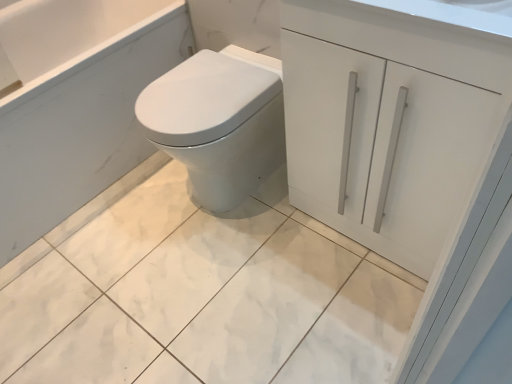
Question: Should I look upward or downward to see white glossy cabinet at upper right?

Choices:
 (A) up
 (B) down

Answer: (A)

Question: Is white glossy bidet at center bigger than white glossy cabinet at upper right?

Choices:
 (A) yes
 (B) no

Answer: (A)

Question: Does white glossy bidet at center lie in front of white glossy cabinet at upper right?

Choices:
 (A) no
 (B) yes

Answer: (A)

Question: Can you confirm if white glossy bidet at center is wider than white glossy cabinet at upper right?

Choices:
 (A) yes
 (B) no

Answer: (A)

Question: Is white glossy bidet at center at the left side of white glossy cabinet at upper right?

Choices:
 (A) yes
 (B) no

Answer: (A)

Question: Considering the relative positions of white glossy bidet at center and white glossy cabinet at upper right in the image provided, is white glossy bidet at center to the right of white glossy cabinet at upper right from the viewer's perspective?

Choices:
 (A) no
 (B) yes

Answer: (A)

Question: From the image's perspective, is white glossy bidet at center on top of white glossy cabinet at upper right?

Choices:
 (A) yes
 (B) no

Answer: (B)

Question: Considering the relative positions of white marble tile at center and white glossy cabinet at upper right in the image provided, is white marble tile at center in front of white glossy cabinet at upper right?

Choices:
 (A) no
 (B) yes

Answer: (A)

Question: Is white marble tile at center not within white glossy cabinet at upper right?

Choices:
 (A) yes
 (B) no

Answer: (A)

Question: Is white marble tile at center to the right of white glossy cabinet at upper right from the viewer's perspective?

Choices:
 (A) no
 (B) yes

Answer: (A)

Question: Can you confirm if white marble tile at center is thinner than white glossy cabinet at upper right?

Choices:
 (A) yes
 (B) no

Answer: (B)

Question: Is white marble tile at center positioned behind white glossy cabinet at upper right?

Choices:
 (A) no
 (B) yes

Answer: (B)

Question: Does white marble tile at center have a smaller size compared to white glossy cabinet at upper right?

Choices:
 (A) yes
 (B) no

Answer: (B)

Question: Is white glossy cabinet at upper right bigger than white glossy bidet at center?

Choices:
 (A) yes
 (B) no

Answer: (B)